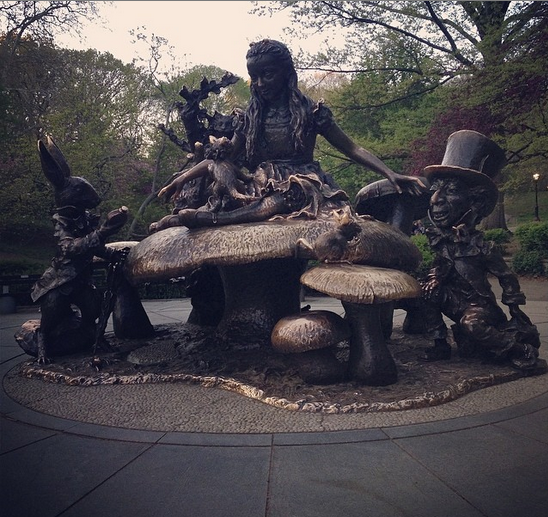
This screenshot has width=548, height=517. I want to click on statue, so click(271, 298).